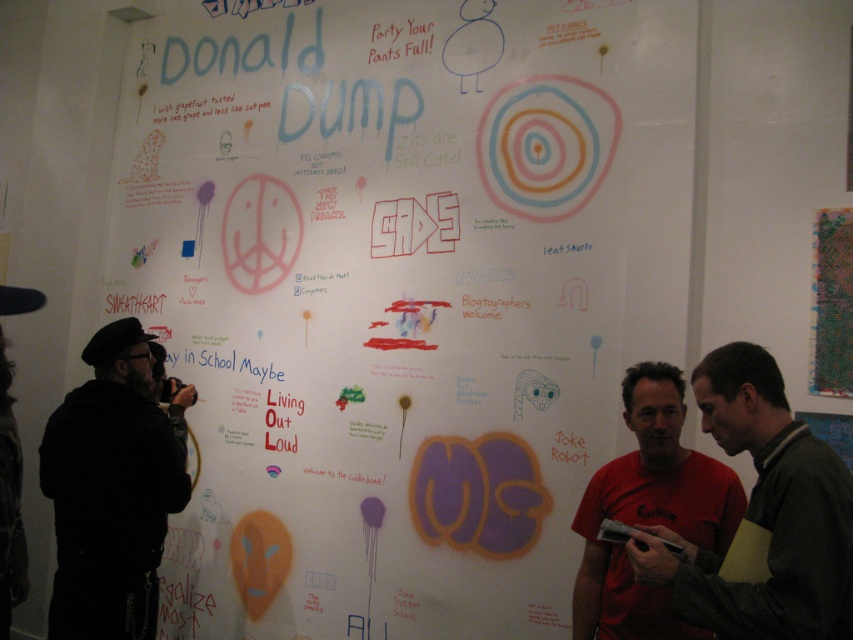
Looking at this image, does white paper poster at center have a greater width compared to black matte jacket at left?

Yes, white paper poster at center is wider than black matte jacket at left.

Is white paper poster at center positioned at the back of black matte jacket at left?

Yes, white paper poster at center is behind black matte jacket at left.

Is point (294, 278) positioned after point (143, 458)?

Yes.

Where is `white paper poster at center`? white paper poster at center is located at coordinates (376, 304).

Does matte black shirt at center appear on the left side of red matte t-shirt at center?

Incorrect, matte black shirt at center is not on the left side of red matte t-shirt at center.

Is point (757, 464) farther from viewer compared to point (718, 524)?

That is False.

Locate an element on the screen. The image size is (853, 640). matte black shirt at center is located at coordinates (764, 513).

Can you confirm if white paper poster at center is positioned to the left of red matte t-shirt at center?

Correct, you'll find white paper poster at center to the left of red matte t-shirt at center.

Who is positioned more to the right, white paper poster at center or red matte t-shirt at center?

From the viewer's perspective, red matte t-shirt at center appears more on the right side.

Where is `white paper poster at center`? The width and height of the screenshot is (853, 640). white paper poster at center is located at coordinates (376, 304).